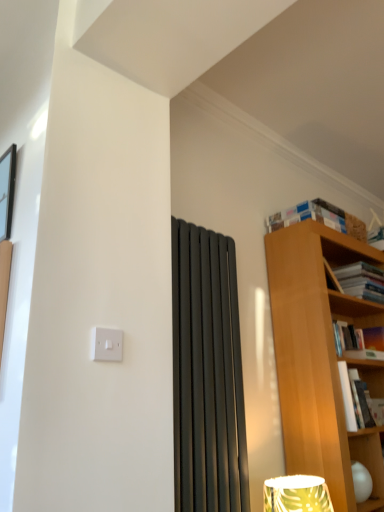
Question: From their relative heights in the image, would you say hardcover book at right, which ranks as the first book in bottom-to-top order, is taller or shorter than white paperbacks at upper right, placed as the first book when sorted from top to bottom?

Choices:
 (A) short
 (B) tall

Answer: (B)

Question: Visually, is hardcover book at right, the 4th book viewed from the top, positioned to the left or to the right of white paperbacks at upper right, placed as the first book when sorted from top to bottom?

Choices:
 (A) right
 (B) left

Answer: (A)

Question: Which of these objects is positioned farthest from the hardcover book at upper right, which ranks as the third book in bottom-to-top order?

Choices:
 (A) hardcover book at right, which ranks as the first book in bottom-to-top order
 (B) hardcover book at upper right, which ranks as the third book in top-to-bottom order
 (C) white plastic light switch at upper left
 (D) white paperbacks at upper right, arranged as the fourth book when ordered from the bottom
 (E) black glass picture frame at upper left

Answer: (E)

Question: Which is nearer to the white plastic light switch at upper left?

Choices:
 (A) hardcover book at right, which ranks as the first book in bottom-to-top order
 (B) hardcover book at upper right, which ranks as the third book in top-to-bottom order
 (C) black glass picture frame at upper left
 (D) hardcover book at upper right, arranged as the second book when viewed from the top
 (E) white paperbacks at upper right, arranged as the fourth book when ordered from the bottom

Answer: (C)